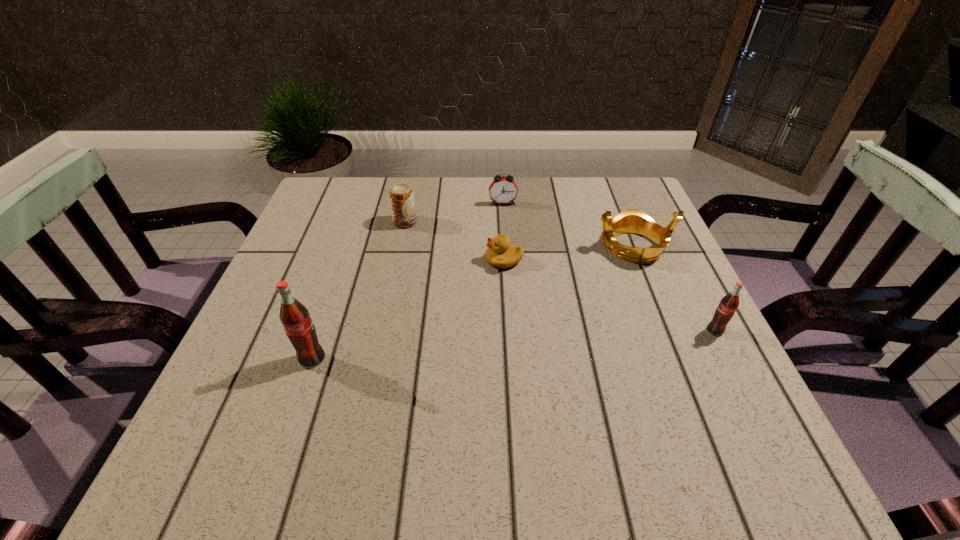
To achieve even spacing by inserting another pop_(soda) among them, please point to a vacant spot for this new pop_(soda). Please provide its 2D coordinates. Your answer should be formatted as a tuple, i.e. [(x, y)], where the tuple contains the x and y coordinates of a point satisfying the conditions above.

[(519, 345)]